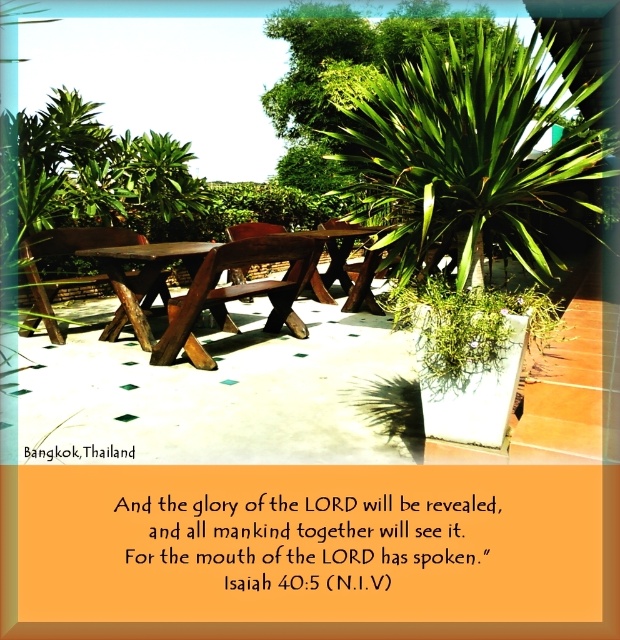
Between dark brown wood picnic table at center and brown wooden table at center, which one has more height?

With more height is brown wooden table at center.

Does dark brown wood picnic table at center have a larger size compared to brown wooden table at center?

Yes.

You are a GUI agent. You are given a task and a screenshot of the screen. Output one action in this format:
    pyautogui.click(x=<x>, y=<y>)
    Task: Click on the dark brown wood picnic table at center
    Image resolution: width=620 pixels, height=640 pixels.
    Given the screenshot: What is the action you would take?
    pyautogui.click(x=223, y=292)

Measure the distance between point (285,241) and camera.

Point (285,241) is 8.31 feet from camera.

What do you see at coordinates (223, 292) in the screenshot? I see `dark brown wood picnic table at center` at bounding box center [223, 292].

What are the coordinates of `dark brown wood picnic table at center` in the screenshot? It's located at (223, 292).

What are the coordinates of `natural wood table at center` in the screenshot? It's located at (141, 280).

Which is above, natural wood table at center or brown wooden table at center?

Positioned higher is brown wooden table at center.

Who is more forward, (99, 257) or (378, 252)?

Positioned in front is point (99, 257).

Identify the location of natural wood table at center. (141, 280).